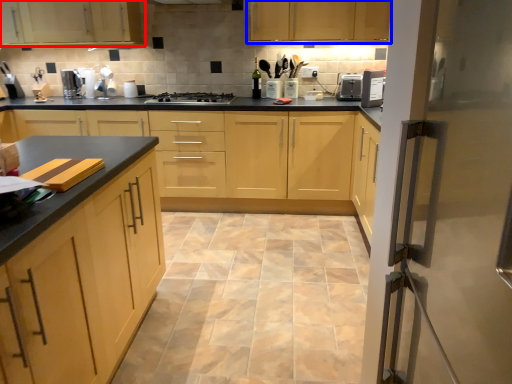
Question: Which object is closer to the camera taking this photo, cabinetry (highlighted by a red box) or cabinetry (highlighted by a blue box)?

Choices:
 (A) cabinetry
 (B) cabinetry

Answer: (B)